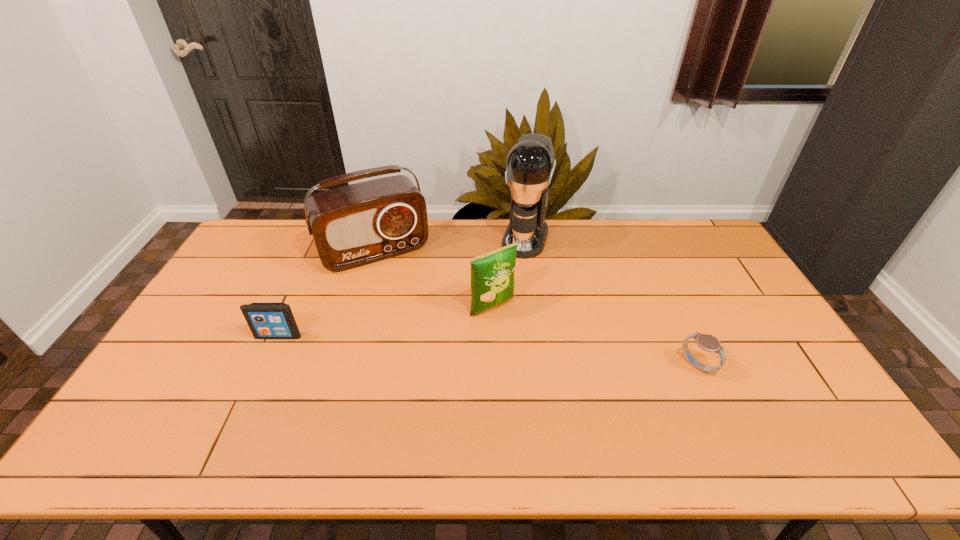
Where is `free space on the desktop that is between the second nearest object and the rightmost object and is positioned place cup under the spout of the tallest object`? free space on the desktop that is between the second nearest object and the rightmost object and is positioned place cup under the spout of the tallest object is located at coordinates (486, 351).

Locate an element on the screen. Image resolution: width=960 pixels, height=540 pixels. free space on the desktop that is between the fourth tallest object and the nearest object and is positioned on the front panel of the second tallest object is located at coordinates (423, 346).

I want to click on vacant space on the desktop that is between the iPod and the shortest object and is positioned on the front-facing side of the third farthest object, so click(x=535, y=354).